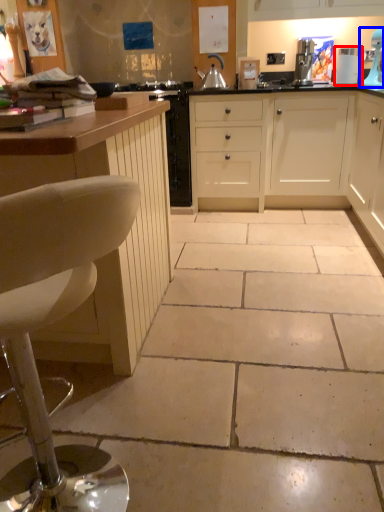
Question: Which point is further to the camera, appliance (highlighted by a red box) or home appliance (highlighted by a blue box)?

Choices:
 (A) appliance
 (B) home appliance

Answer: (A)